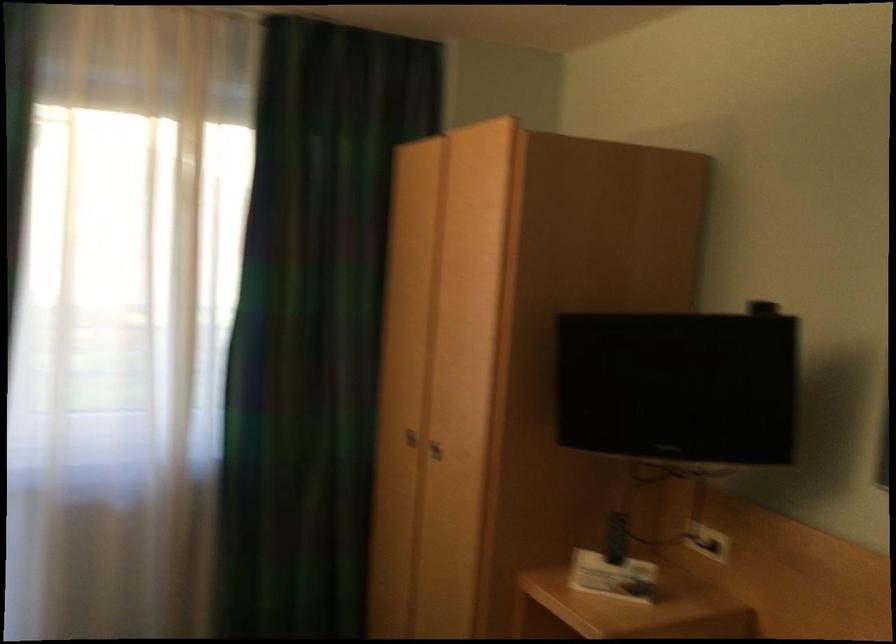
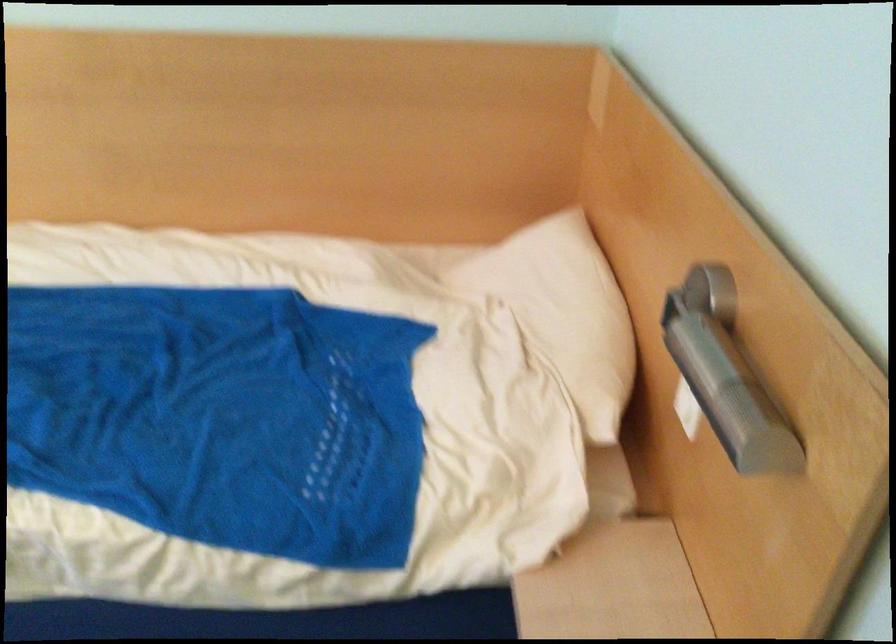
Based on the continuous images, in which direction is the camera rotating?

The rotation direction of the camera is right-down.